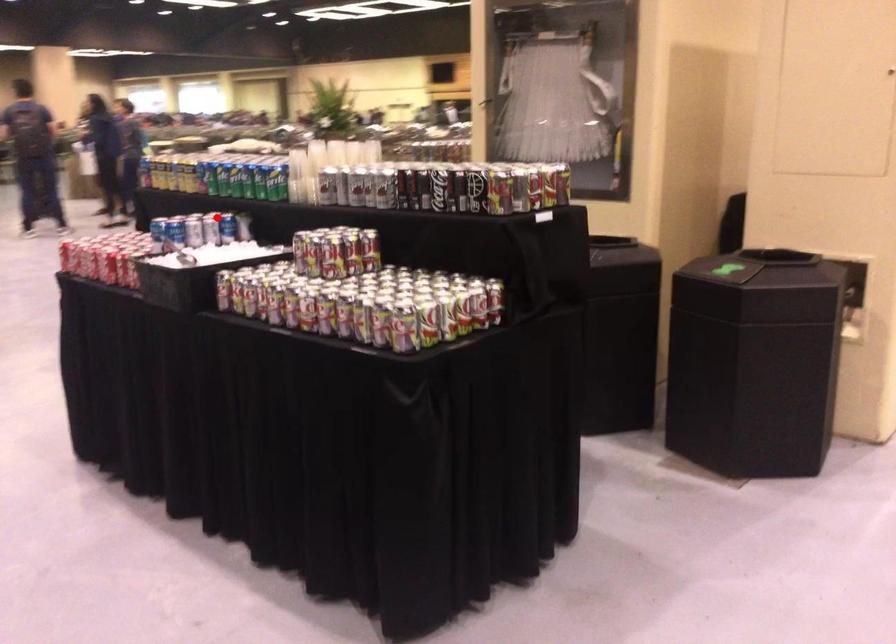
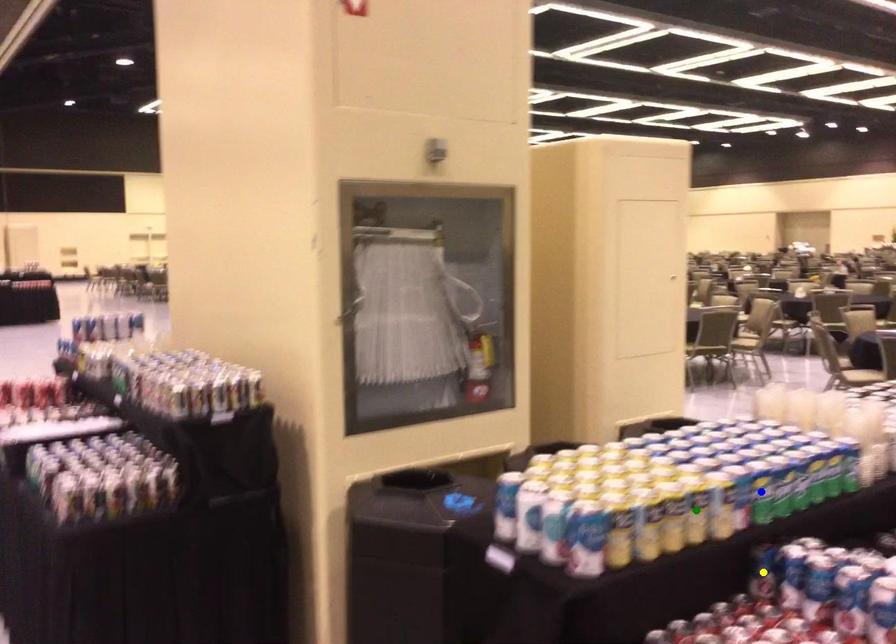
Question: I am providing you with two images of the same scene from different viewpoints. A red point is marked on the first image. You are given multiple points on the second image. Which spot in image 2 lines up with the point in image 1?

Choices:
 (A) green point
 (B) blue point
 (C) yellow point

Answer: (C)